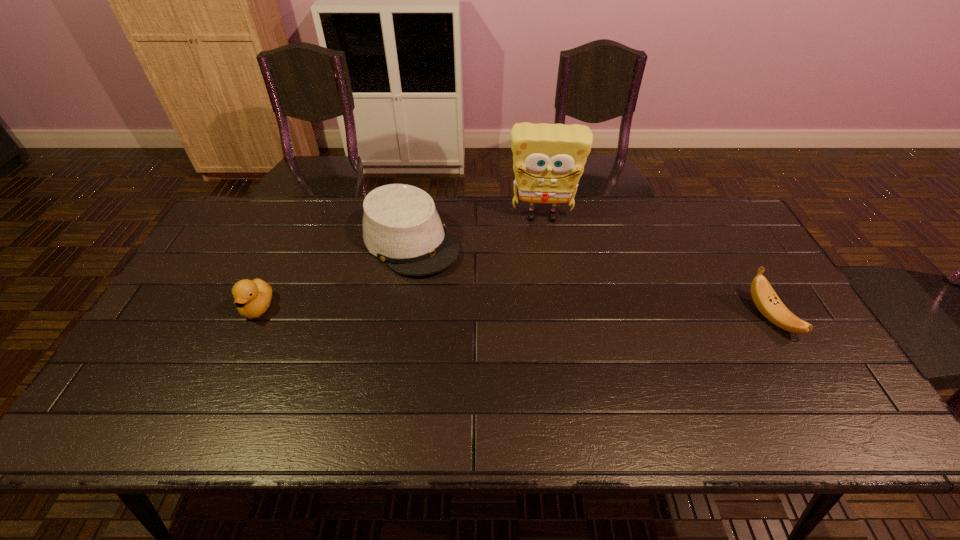
I want to click on vacant area that lies between the second object from right to left and the banana, so click(x=656, y=267).

Where is `vacant space that's between the duckling and the rightmost object`? This screenshot has width=960, height=540. vacant space that's between the duckling and the rightmost object is located at coordinates pos(514,313).

I want to click on the second closest object to the leftmost object, so click(x=548, y=159).

Select which object is the third closest to the rightmost object. Please provide its 2D coordinates. Your answer should be formatted as a tuple, i.e. [(x, y)], where the tuple contains the x and y coordinates of a point satisfying the conditions above.

[(252, 298)]

Find the location of `vacant space that satisfies the following two spatial constraints: 1. on the front side of the sponge; 2. on the left side of the banana`. vacant space that satisfies the following two spatial constraints: 1. on the front side of the sponge; 2. on the left side of the banana is located at coordinates (558, 318).

You are a GUI agent. You are given a task and a screenshot of the screen. Output one action in this format:
    pyautogui.click(x=<x>, y=<y>)
    Task: Click on the free space that satisfies the following two spatial constraints: 1. facing forward on the banana; 2. on the right side of the leftmost object
    
    Given the screenshot: What is the action you would take?
    click(x=253, y=318)